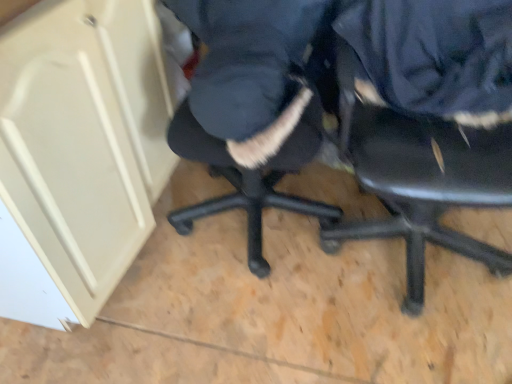
Question: Considering the relative sizes of black plastic chair at center and navy blue fabric at center, the 1th clothing in the left-to-right sequence, in the image provided, is black plastic chair at center taller than navy blue fabric at center, the 1th clothing in the left-to-right sequence,?

Choices:
 (A) no
 (B) yes

Answer: (B)

Question: Would you say navy blue fabric at center, the second clothing from the right, is part of black plastic chair at center's contents?

Choices:
 (A) no
 (B) yes

Answer: (A)

Question: Can you confirm if black plastic chair at center is positioned to the right of navy blue fabric at center, the second clothing from the right?

Choices:
 (A) no
 (B) yes

Answer: (B)

Question: Considering the relative sizes of black plastic chair at center and navy blue fabric at center, the 1th clothing in the left-to-right sequence, in the image provided, is black plastic chair at center bigger than navy blue fabric at center, the 1th clothing in the left-to-right sequence,?

Choices:
 (A) yes
 (B) no

Answer: (A)

Question: Does black plastic chair at center have a lesser height compared to navy blue fabric at center, the 1th clothing in the left-to-right sequence?

Choices:
 (A) no
 (B) yes

Answer: (A)

Question: Considering the positions of navy blue fabric at upper right, the 2th clothing from the left, and black plastic chair at center in the image, is navy blue fabric at upper right, the 2th clothing from the left, wider or thinner than black plastic chair at center?

Choices:
 (A) thin
 (B) wide

Answer: (A)

Question: From a real-world perspective, is navy blue fabric at upper right, which ranks as the first clothing in right-to-left order, above or below black plastic chair at center?

Choices:
 (A) above
 (B) below

Answer: (A)

Question: From the image's perspective, relative to black plastic chair at center, is navy blue fabric at upper right, which ranks as the first clothing in right-to-left order, above or below?

Choices:
 (A) above
 (B) below

Answer: (A)

Question: In terms of height, does navy blue fabric at upper right, which ranks as the first clothing in right-to-left order, look taller or shorter compared to black plastic chair at center?

Choices:
 (A) short
 (B) tall

Answer: (A)

Question: Is black plastic chair at center in front of or behind beige matte cabinet at upper left in the image?

Choices:
 (A) front
 (B) behind

Answer: (A)

Question: Is black plastic chair at center wider or thinner than beige matte cabinet at upper left?

Choices:
 (A) wide
 (B) thin

Answer: (A)

Question: Considering the relative positions of black plastic chair at center and beige matte cabinet at upper left in the image provided, is black plastic chair at center to the left or to the right of beige matte cabinet at upper left?

Choices:
 (A) right
 (B) left

Answer: (A)

Question: Which is correct: black plastic chair at center is inside beige matte cabinet at upper left, or outside of it?

Choices:
 (A) inside
 (B) outside

Answer: (B)

Question: Is beige matte cabinet at upper left bigger or smaller than navy blue fabric at center, the 1th clothing in the left-to-right sequence?

Choices:
 (A) small
 (B) big

Answer: (B)

Question: Considering the relative positions of beige matte cabinet at upper left and navy blue fabric at center, the 1th clothing in the left-to-right sequence, in the image provided, is beige matte cabinet at upper left to the left or to the right of navy blue fabric at center, the 1th clothing in the left-to-right sequence,?

Choices:
 (A) right
 (B) left

Answer: (B)